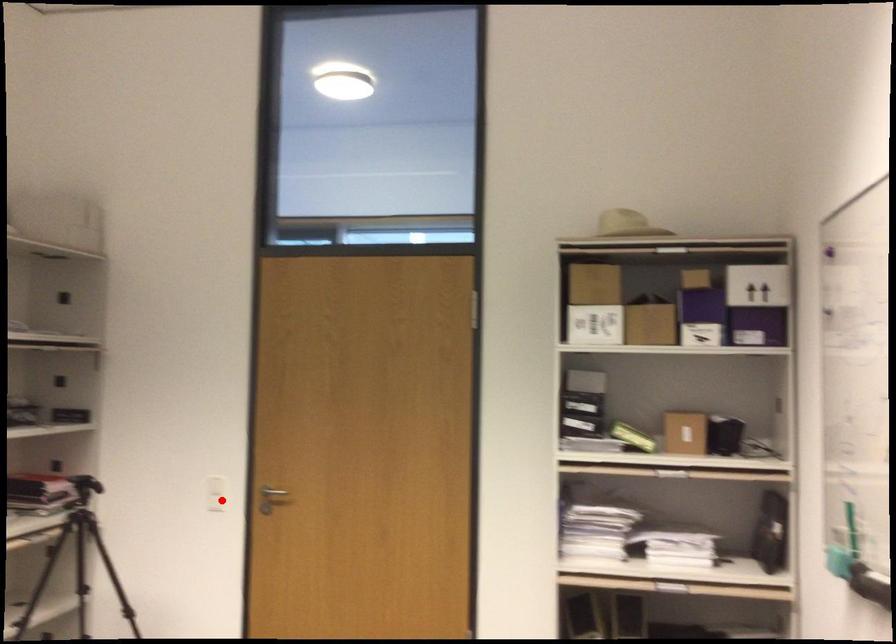
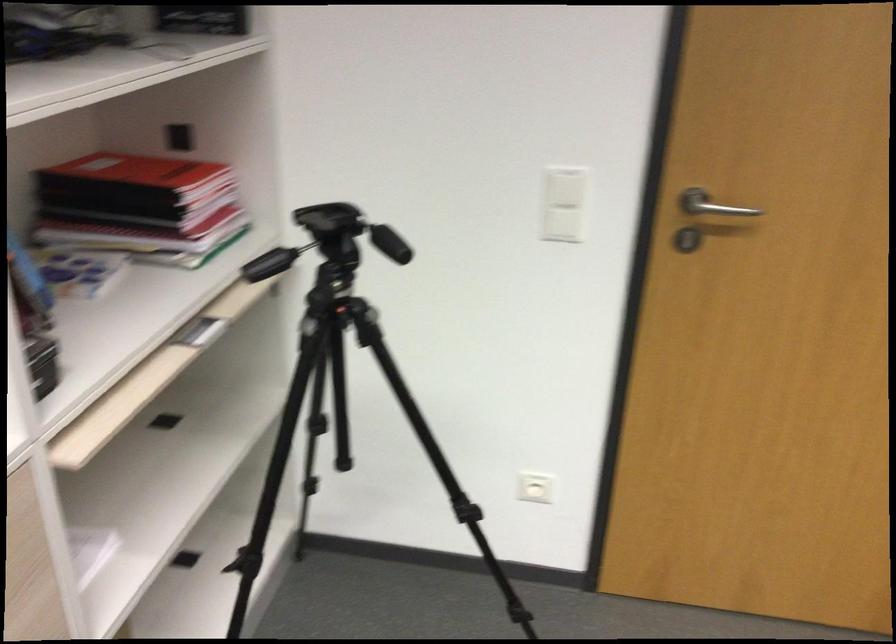
Question: A red point is marked in image1. In image2, is the corresponding 3D point closer to the camera or farther? Reply with the corresponding letter.

Choices:
 (A) The corresponding 3D point is closer.
 (B) The corresponding 3D point is farther.

Answer: (A)